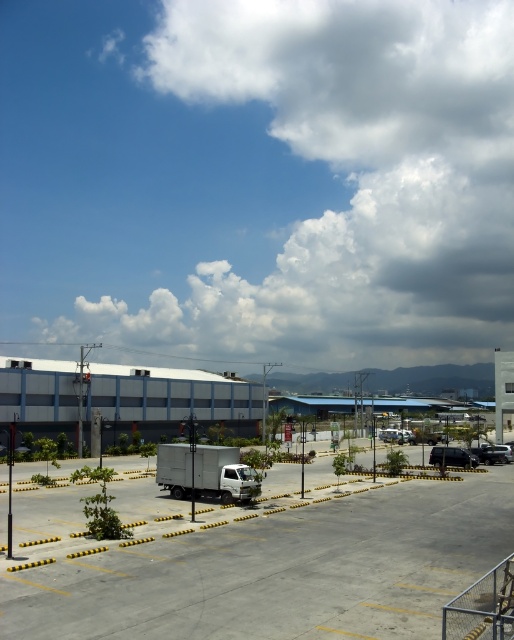
Is metallic silver truck at lower right to the left of silver metallic sedan at center from the viewer's perspective?

Indeed, metallic silver truck at lower right is positioned on the left side of silver metallic sedan at center.

Between metallic silver truck at lower right and silver metallic sedan at center, which one has more height?

metallic silver truck at lower right is taller.

Describe the element at coordinates (451, 458) in the screenshot. I see `metallic silver truck at lower right` at that location.

The height and width of the screenshot is (640, 514). In order to click on metallic silver truck at lower right in this screenshot , I will do `click(451, 458)`.

Does white fluffy cloud at upper center have a lesser width compared to gray matte truck at center?

No.

This screenshot has height=640, width=514. Describe the element at coordinates (340, 179) in the screenshot. I see `white fluffy cloud at upper center` at that location.

Which is in front, point (497, 184) or point (201, 486)?

Point (201, 486)

This screenshot has height=640, width=514. I want to click on white fluffy cloud at upper center, so click(340, 179).

Does dark gray concrete building at left appear on the left side of metallic silver truck at lower right?

Correct, you'll find dark gray concrete building at left to the left of metallic silver truck at lower right.

Who is taller, dark gray concrete building at left or metallic silver truck at lower right?

Standing taller between the two is dark gray concrete building at left.

You are a GUI agent. You are given a task and a screenshot of the screen. Output one action in this format:
    pyautogui.click(x=<x>, y=<y>)
    Task: Click on the dark gray concrete building at left
    The width and height of the screenshot is (514, 640).
    Given the screenshot: What is the action you would take?
    pyautogui.click(x=168, y=401)

You are a GUI agent. You are given a task and a screenshot of the screen. Output one action in this format:
    pyautogui.click(x=<x>, y=<y>)
    Task: Click on the dark gray concrete building at left
    This screenshot has width=514, height=640.
    Given the screenshot: What is the action you would take?
    pyautogui.click(x=168, y=401)